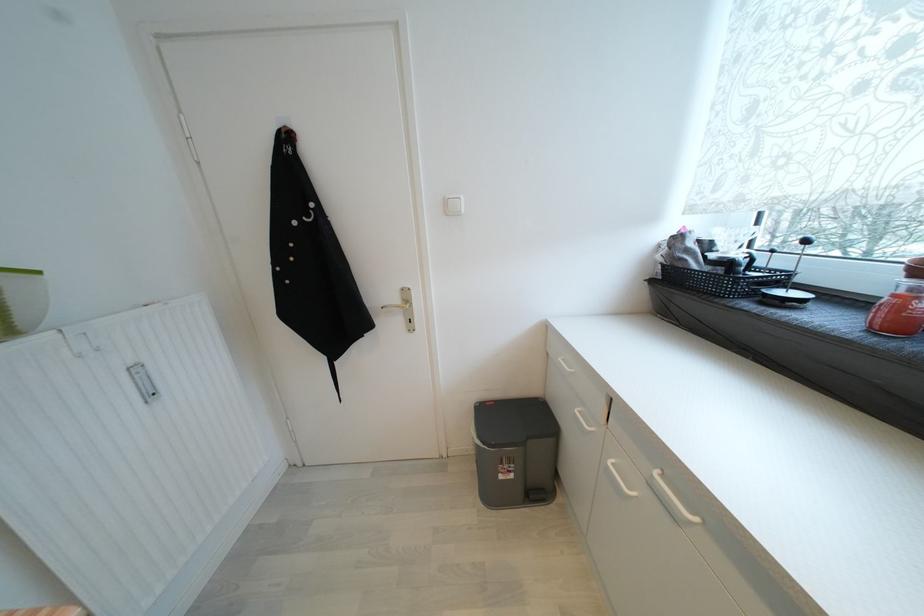
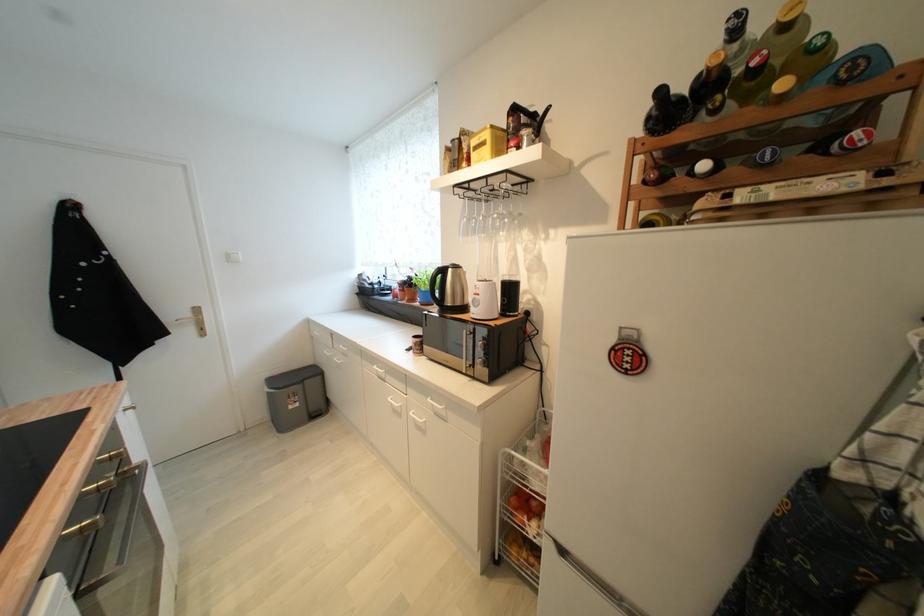
Where in the second image is the point corresponding to the point at 505,479 from the first image?

(296, 408)